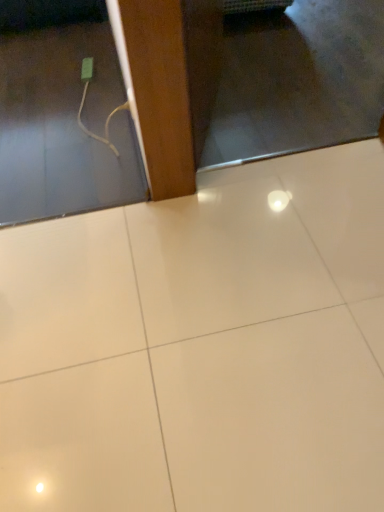
What do you see at coordinates (87, 69) in the screenshot?
I see `green matte electric outlet at upper left` at bounding box center [87, 69].

Where is `green matte electric outlet at upper left`? Image resolution: width=384 pixels, height=512 pixels. green matte electric outlet at upper left is located at coordinates (87, 69).

Image resolution: width=384 pixels, height=512 pixels. Identify the location of green matte electric outlet at upper left. (87, 69).